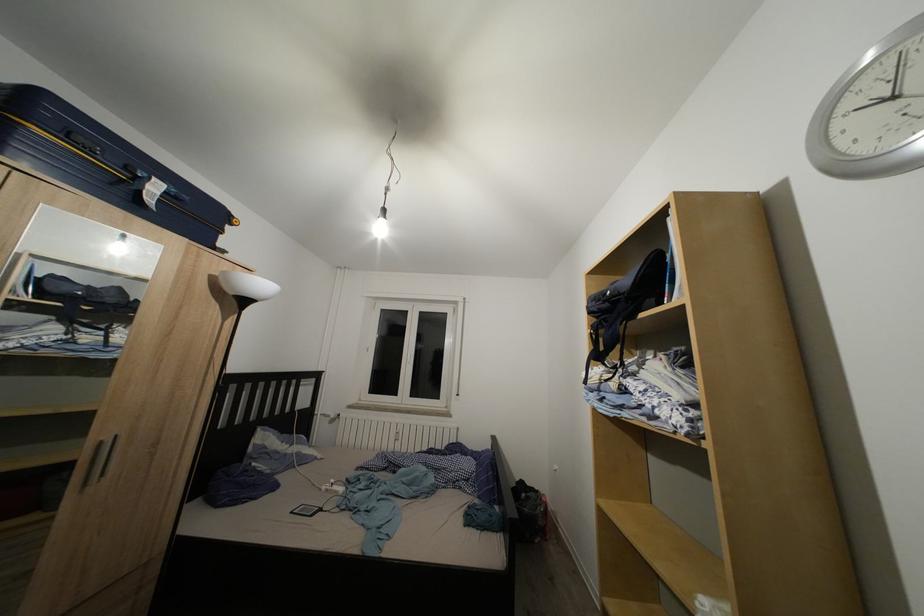
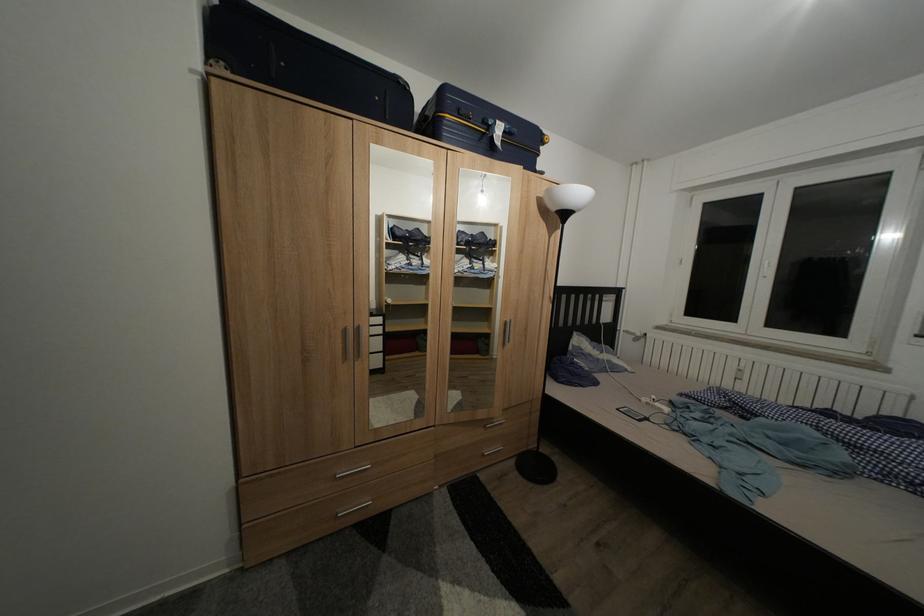
Question: Based on the continuous images, in which direction is the camera rotating? Reply with the corresponding letter.

Choices:
 (A) Left
 (B) Right
 (C) Up
 (D) Down

Answer: (A)